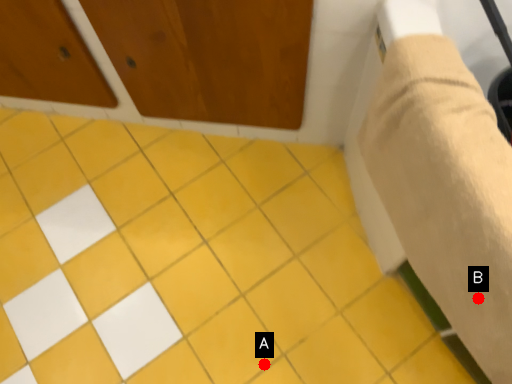
Question: Two points are circled on the image, labeled by A and B beside each circle. Which point appears farthest from the camera in this image?

Choices:
 (A) A is further
 (B) B is further

Answer: (A)